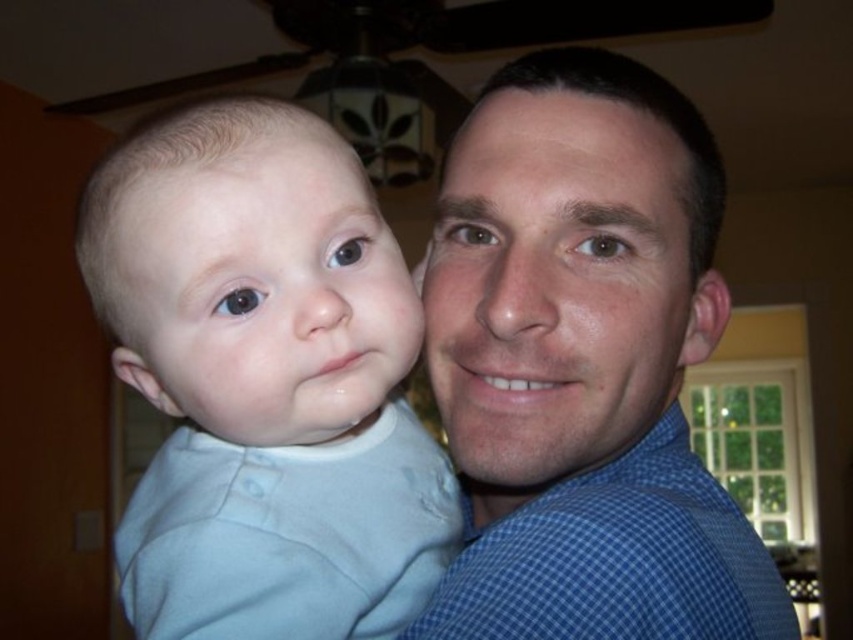
Between point (314, 275) and point (471, 556), which one is positioned in front?

Point (314, 275) is in front.

Can you confirm if light blue fabric baby at center is taller than blue checkered shirt at right?

Yes.

Is point (271, 476) behind point (461, 550)?

No.

This screenshot has width=853, height=640. Identify the location of light blue fabric baby at center. (264, 381).

Which of these two, blue checkered shirt at center or smooth skin baby at left, stands taller?

blue checkered shirt at center is taller.

The image size is (853, 640). In order to click on blue checkered shirt at center in this screenshot , I will do `click(584, 364)`.

The image size is (853, 640). I want to click on blue checkered shirt at center, so click(x=584, y=364).

Does smooth blue shirt at right appear over smooth skin baby at left?

Yes, smooth blue shirt at right is above smooth skin baby at left.

The height and width of the screenshot is (640, 853). I want to click on smooth blue shirt at right, so click(556, 285).